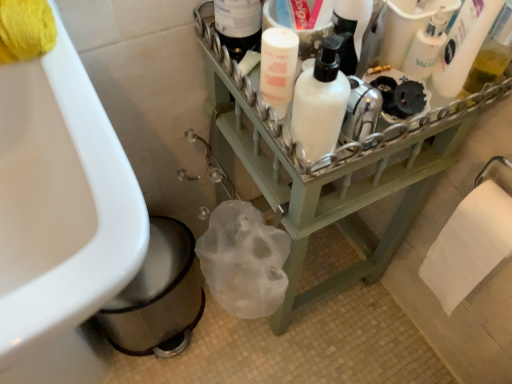
How much space does yellow sponge at upper left, the 1th toilet paper in the front-to-back sequence, occupy horizontally?

yellow sponge at upper left, the 1th toilet paper in the front-to-back sequence, is 5.65 inches in width.

The height and width of the screenshot is (384, 512). Describe the element at coordinates (469, 244) in the screenshot. I see `white paper towel at lower right, positioned as the first toilet paper in bottom-to-top order` at that location.

The image size is (512, 384). What do you see at coordinates (61, 219) in the screenshot?
I see `white glossy sink at lower left` at bounding box center [61, 219].

What do you see at coordinates (426, 46) in the screenshot? Image resolution: width=512 pixels, height=384 pixels. I see `white matte bottle at upper right, the second cleaning product from the right` at bounding box center [426, 46].

Identify the location of white matte bottle at upper center. (238, 25).

Considering the relative positions of white matte pump bottle at upper center, which is the 1th cleaning product in left-to-right order, and translucent plastic bottle at upper right, the fourth cleaning product when ordered from left to right, in the image provided, is white matte pump bottle at upper center, which is the 1th cleaning product in left-to-right order, to the right of translucent plastic bottle at upper right, the fourth cleaning product when ordered from left to right, from the viewer's perspective?

No, white matte pump bottle at upper center, which is the 1th cleaning product in left-to-right order, is not to the right of translucent plastic bottle at upper right, the fourth cleaning product when ordered from left to right.

Locate an element on the screen. The width and height of the screenshot is (512, 384). the 2nd cleaning product below the translucent plastic bottle at upper right, the 1th cleaning product when ordered from right to left (from the image's perspective) is located at coordinates (278, 67).

Is white matte pump bottle at upper center, which is the 1th cleaning product in left-to-right order, inside or outside of translucent plastic bottle at upper right, the fourth cleaning product when ordered from left to right?

white matte pump bottle at upper center, which is the 1th cleaning product in left-to-right order, cannot be found inside translucent plastic bottle at upper right, the fourth cleaning product when ordered from left to right.

Considering the relative sizes of white matte pump bottle at upper center, the 4th cleaning product when ordered from right to left, and translucent plastic bottle at upper right, the 1th cleaning product when ordered from right to left, in the image provided, is white matte pump bottle at upper center, the 4th cleaning product when ordered from right to left, wider than translucent plastic bottle at upper right, the 1th cleaning product when ordered from right to left,?

Correct, the width of white matte pump bottle at upper center, the 4th cleaning product when ordered from right to left, exceeds that of translucent plastic bottle at upper right, the 1th cleaning product when ordered from right to left.

Do you think white glossy sink at lower left is within white matte pump bottle at upper center, which is the 1th cleaning product in left-to-right order, or outside of it?

white glossy sink at lower left lies outside white matte pump bottle at upper center, which is the 1th cleaning product in left-to-right order.

Is white glossy sink at lower left next to white matte pump bottle at upper center, the 4th cleaning product when ordered from right to left?

white glossy sink at lower left is not next to white matte pump bottle at upper center, the 4th cleaning product when ordered from right to left, and they're not touching.

Is white glossy sink at lower left wider or thinner than white matte pump bottle at upper center, the 4th cleaning product when ordered from right to left?

In the image, white glossy sink at lower left appears to be wider than white matte pump bottle at upper center, the 4th cleaning product when ordered from right to left.

Is white glossy sink at lower left looking in the opposite direction of white matte pump bottle at upper center, which is the 1th cleaning product in left-to-right order?

white glossy sink at lower left does not have its back to white matte pump bottle at upper center, which is the 1th cleaning product in left-to-right order.

Which object is positioned more to the left, white matte bottle at upper center or yellow sponge at upper left, the second toilet paper when ordered from bottom to top?

From the viewer's perspective, yellow sponge at upper left, the second toilet paper when ordered from bottom to top, appears more on the left side.

From the image's perspective, is white matte bottle at upper center under yellow sponge at upper left, arranged as the first toilet paper when viewed from the left?

No, from the image's perspective, white matte bottle at upper center is not beneath yellow sponge at upper left, arranged as the first toilet paper when viewed from the left.

From a real-world perspective, is white matte bottle at upper center positioned above or below yellow sponge at upper left, positioned as the 2th toilet paper in back-to-front order?

white matte bottle at upper center is situated lower than yellow sponge at upper left, positioned as the 2th toilet paper in back-to-front order, in the real world.

How many degrees apart are the facing directions of white matte bottle at upper center and yellow sponge at upper left, arranged as the first toilet paper when viewed from the top?

3.12 degrees separate the facing orientations of white matte bottle at upper center and yellow sponge at upper left, arranged as the first toilet paper when viewed from the top.

From a real-world perspective, which object stands above the other?

From a 3D spatial view, white matte bottle at upper center is above.

Between white matte bottle at upper center and white glossy sink at lower left, which one appears on the right side from the viewer's perspective?

white matte bottle at upper center is more to the right.

Would you consider white matte bottle at upper center to be distant from white glossy sink at lower left?

No, white matte bottle at upper center is not far from white glossy sink at lower left.

Considering the relative sizes of white matte bottle at upper right, the second cleaning product from the right, and yellow sponge at upper left, positioned as the 2th toilet paper in back-to-front order, in the image provided, is white matte bottle at upper right, the second cleaning product from the right, taller than yellow sponge at upper left, positioned as the 2th toilet paper in back-to-front order,?

Indeed, white matte bottle at upper right, the second cleaning product from the right, has a greater height compared to yellow sponge at upper left, positioned as the 2th toilet paper in back-to-front order.

Is white matte bottle at upper right, which appears as the 3th cleaning product when viewed from the left, smaller than yellow sponge at upper left, the second toilet paper when ordered from bottom to top?

Indeed, white matte bottle at upper right, which appears as the 3th cleaning product when viewed from the left, has a smaller size compared to yellow sponge at upper left, the second toilet paper when ordered from bottom to top.

From a real-world perspective, relative to yellow sponge at upper left, arranged as the first toilet paper when viewed from the top, is white matte bottle at upper right, the second cleaning product from the right, vertically above or below?

Clearly, from a real-world perspective, white matte bottle at upper right, the second cleaning product from the right, is below yellow sponge at upper left, arranged as the first toilet paper when viewed from the top.

Considering their positions, is white matte bottle at upper right, which appears as the 3th cleaning product when viewed from the left, located in front of or behind yellow sponge at upper left, positioned as the 2th toilet paper in back-to-front order?

In the image, white matte bottle at upper right, which appears as the 3th cleaning product when viewed from the left, appears behind yellow sponge at upper left, positioned as the 2th toilet paper in back-to-front order.

Considering the positions of point (22, 44) and point (404, 72), is point (22, 44) closer or farther from the camera than point (404, 72)?

Point (22, 44) is closer to the camera than point (404, 72).

Who is bigger, yellow sponge at upper left, arranged as the first toilet paper when viewed from the left, or white matte bottle at upper right, which appears as the 3th cleaning product when viewed from the left?

With larger size is yellow sponge at upper left, arranged as the first toilet paper when viewed from the left.

The height and width of the screenshot is (384, 512). What are the coordinates of `cleaning product that is the 3rd one when counting rightward from the yellow sponge at upper left, arranged as the first toilet paper when viewed from the left` in the screenshot? It's located at (426, 46).

Based on the photo, is yellow sponge at upper left, the second toilet paper when ordered from bottom to top, shorter than white matte bottle at upper right, the second cleaning product from the right?

Yes, yellow sponge at upper left, the second toilet paper when ordered from bottom to top, is shorter than white matte bottle at upper right, the second cleaning product from the right.

Could you tell me if white paper towel at lower right, the second toilet paper in the top-to-bottom sequence, is turned towards white matte bottle at upper center?

No, white paper towel at lower right, the second toilet paper in the top-to-bottom sequence, is not facing towards white matte bottle at upper center.

Considering the relative positions of white paper towel at lower right, which ranks as the second toilet paper in left-to-right order, and white matte bottle at upper center in the image provided, is white paper towel at lower right, which ranks as the second toilet paper in left-to-right order, to the left of white matte bottle at upper center from the viewer's perspective?

In fact, white paper towel at lower right, which ranks as the second toilet paper in left-to-right order, is to the right of white matte bottle at upper center.

Looking at this image, from a real-world perspective, who is located lower, white paper towel at lower right, positioned as the 2th toilet paper in front-to-back order, or white matte bottle at upper center?

In real-world perspective, white paper towel at lower right, positioned as the 2th toilet paper in front-to-back order, is lower.

Is white paper towel at lower right, which ranks as the second toilet paper in left-to-right order, further to camera compared to white matte bottle at upper center?

Yes, the depth of white paper towel at lower right, which ranks as the second toilet paper in left-to-right order, is greater than that of white matte bottle at upper center.

From the translucent plastic bottle at upper right, the fourth cleaning product when ordered from left to right, count the 3rd cleaning product to the left and point to it. Please provide its 2D coordinates.

[(278, 67)]

From the white glossy sink at lower left, count 3rd cleaning products backward and point to it. Please provide its 2D coordinates.

[(278, 67)]

Looking at the image, which one is located further to white matte bottle at upper center, arranged as the second cleaning product when viewed from the left, translucent plastic bottle at upper right, the 1th cleaning product when ordered from right to left, or white matte bottle at upper center?

Based on the image, white matte bottle at upper center appears to be further to white matte bottle at upper center, arranged as the second cleaning product when viewed from the left.

Looking at this image, considering their positions, is yellow sponge at upper left, the second toilet paper in the right-to-left sequence, positioned closer to white matte bottle at upper right, the second cleaning product from the right, than white matte bottle at upper center, which ranks as the third cleaning product in right-to-left order?

white matte bottle at upper center, which ranks as the third cleaning product in right-to-left order, is closer to white matte bottle at upper right, the second cleaning product from the right.

Which object lies nearer to the anchor point white paper towel at lower right, placed as the 1th toilet paper when sorted from right to left, yellow sponge at upper left, arranged as the first toilet paper when viewed from the left, or green wood shelf at center?

The object closer to white paper towel at lower right, placed as the 1th toilet paper when sorted from right to left, is green wood shelf at center.

Estimate the real-world distances between objects in this image. Which object is further from white paper towel at lower right, which ranks as the second toilet paper in left-to-right order, translucent plastic bottle at upper right, the fourth cleaning product when ordered from left to right, or white matte bottle at upper center, arranged as the second cleaning product when viewed from the left?

The object further to white paper towel at lower right, which ranks as the second toilet paper in left-to-right order, is white matte bottle at upper center, arranged as the second cleaning product when viewed from the left.

From the image, which object appears to be nearer to white matte bottle at upper center, which ranks as the third cleaning product in right-to-left order, white paper towel at lower right, which ranks as the second toilet paper in left-to-right order, or white matte bottle at upper center?

white matte bottle at upper center is positioned closer to the anchor white matte bottle at upper center, which ranks as the third cleaning product in right-to-left order.

Based on their spatial positions, is white matte bottle at upper right, which appears as the 3th cleaning product when viewed from the left, or yellow sponge at upper left, the 1th toilet paper in the front-to-back sequence, further from white matte bottle at upper center, which ranks as the third cleaning product in right-to-left order?

Based on the image, yellow sponge at upper left, the 1th toilet paper in the front-to-back sequence, appears to be further to white matte bottle at upper center, which ranks as the third cleaning product in right-to-left order.

Estimate the real-world distances between objects in this image. Which object is closer to white paper towel at lower right, which is counted as the 1th toilet paper, starting from the back, translucent plastic bottle at upper right, the 1th cleaning product when ordered from right to left, or white matte pump bottle at upper center, which is the 1th cleaning product in left-to-right order?

translucent plastic bottle at upper right, the 1th cleaning product when ordered from right to left, is positioned closer to the anchor white paper towel at lower right, which is counted as the 1th toilet paper, starting from the back.

Considering their positions, is white glossy sink at lower left positioned closer to yellow sponge at upper left, arranged as the first toilet paper when viewed from the left, than green wood shelf at center?

The object closer to yellow sponge at upper left, arranged as the first toilet paper when viewed from the left, is white glossy sink at lower left.

Identify the location of furniture situated between white matte bottle at upper center and white paper towel at lower right, placed as the 1th toilet paper when sorted from right to left, from left to right. (330, 167).

Where is `bottle situated between yellow sponge at upper left, arranged as the first toilet paper when viewed from the left, and translucent plastic bottle at upper right, the fourth cleaning product when ordered from left to right, from left to right`? bottle situated between yellow sponge at upper left, arranged as the first toilet paper when viewed from the left, and translucent plastic bottle at upper right, the fourth cleaning product when ordered from left to right, from left to right is located at coordinates (238, 25).

Image resolution: width=512 pixels, height=384 pixels. In order to click on toilet paper located between white glossy sink at lower left and white matte bottle at upper center, arranged as the second cleaning product when viewed from the left, in the left-right direction in this screenshot , I will do `click(25, 29)`.

Locate an element on the screen. furniture between white glossy sink at lower left and white paper towel at lower right, the second toilet paper in the top-to-bottom sequence, from left to right is located at coordinates (330, 167).